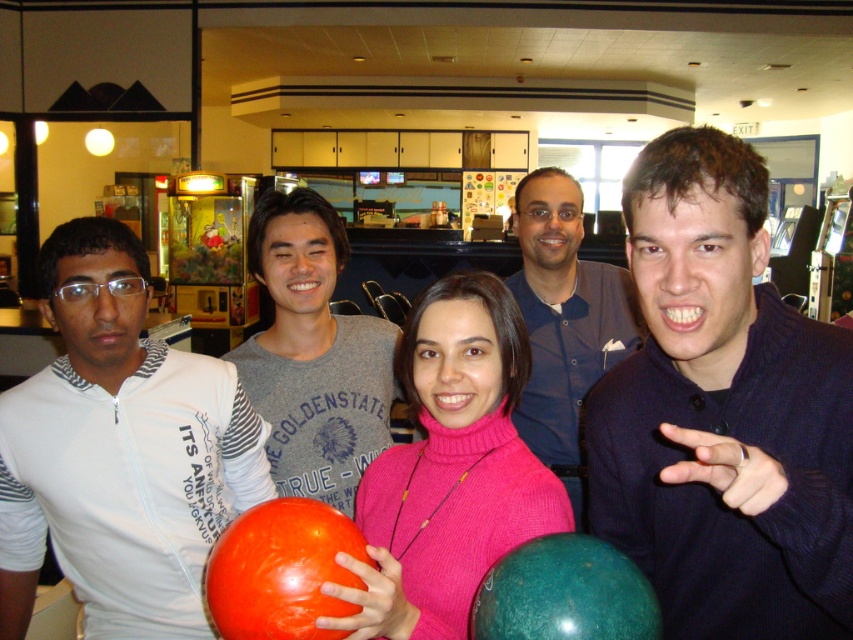
Question: Which point is farther to the camera?

Choices:
 (A) matte gray t-shirt at center
 (B) pink turtleneck sweater at center
 (C) dark blue sweater at right

Answer: (A)

Question: Does white striped shirt at left appear on the left side of pink turtleneck sweater at center?

Choices:
 (A) no
 (B) yes

Answer: (B)

Question: Is dark blue sweater at right positioned before pink turtleneck sweater at center?

Choices:
 (A) yes
 (B) no

Answer: (A)

Question: Which object is positioned closest to the pink turtleneck sweater at center?

Choices:
 (A) dark blue sweater at right
 (B) white striped shirt at left

Answer: (A)

Question: Does white striped shirt at left appear under matte gray t-shirt at center?

Choices:
 (A) yes
 (B) no

Answer: (A)

Question: Which object is closer to the camera taking this photo?

Choices:
 (A) matte gray t-shirt at center
 (B) dark blue sweater at right
 (C) pink turtleneck sweater at center
 (D) white striped shirt at left

Answer: (B)